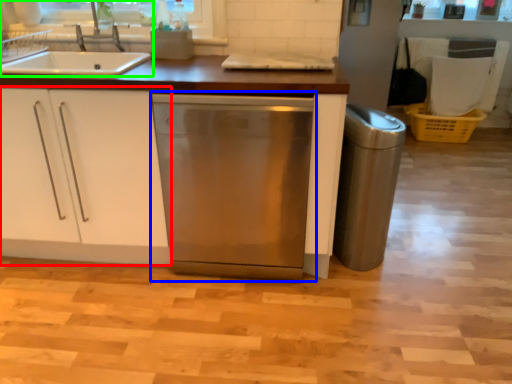
Question: Based on their relative distances, which object is farther from cabinetry (highlighted by a red box)? Choose from home appliance (highlighted by a blue box) and kitchen appliance (highlighted by a green box).

Choices:
 (A) home appliance
 (B) kitchen appliance

Answer: (B)